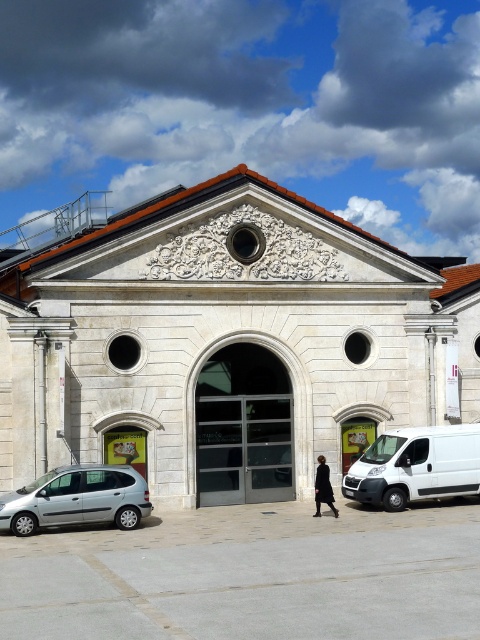
You are a delivery person who needs to park your vehicle next to the building. You have a silver metallic minivan at lower left and a black matte coat at center in the image. Which vehicle has a wider body to accommodate more packages?

The silver metallic minivan at lower left has a larger width than the black matte coat at center, so it can accommodate more packages due to its wider body.

You are standing in front of the classical building and see the white stone church at center and the black matte coat at center. Which object is positioned to the left of the other?

The white stone church at center is to the left of the black matte coat at center.